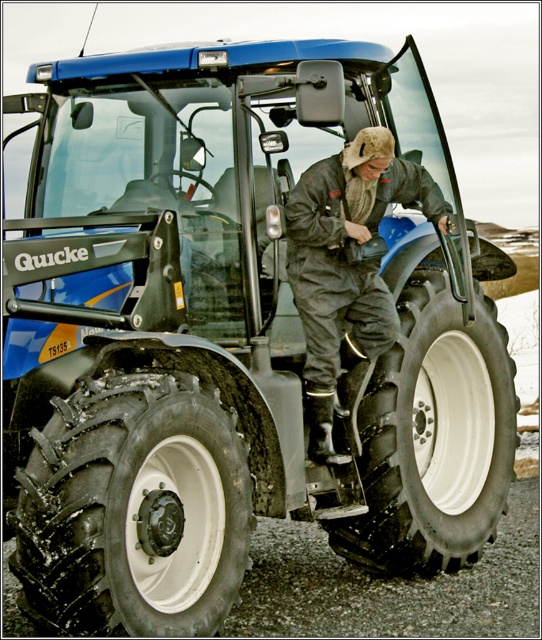
Question: Does black rubber tire at lower left lie behind black rubber tire at lower center?

Choices:
 (A) yes
 (B) no

Answer: (B)

Question: Can you confirm if black rubber tire at lower left is smaller than dark gray/leather jacket at center?

Choices:
 (A) no
 (B) yes

Answer: (A)

Question: Which object is the farthest from the black rubber tire at lower left?

Choices:
 (A) dark gray/leather jacket at center
 (B) black rubber tire at lower center

Answer: (B)

Question: Among these points, which one is nearest to the camera?

Choices:
 (A) (215, 534)
 (B) (444, 372)
 (C) (390, 300)

Answer: (A)

Question: Can you confirm if black rubber tire at lower left is smaller than black rubber tire at lower center?

Choices:
 (A) no
 (B) yes

Answer: (B)

Question: Which point appears closest to the camera in this image?

Choices:
 (A) (462, 339)
 (B) (67, 544)

Answer: (B)